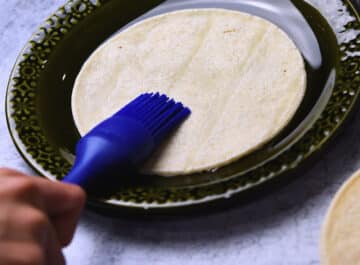
Where is `plate`? The width and height of the screenshot is (360, 265). plate is located at coordinates (x=343, y=42).